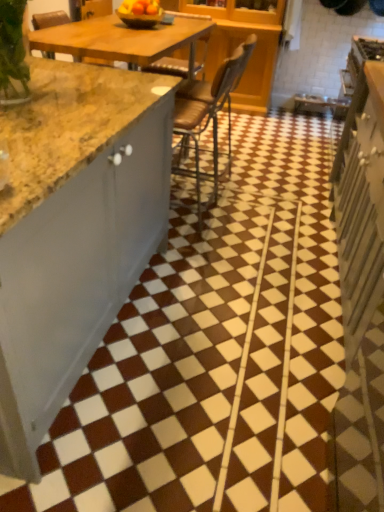
This screenshot has height=512, width=384. What are the coordinates of `free area behind brown leather chair at center` in the screenshot? It's located at (233, 160).